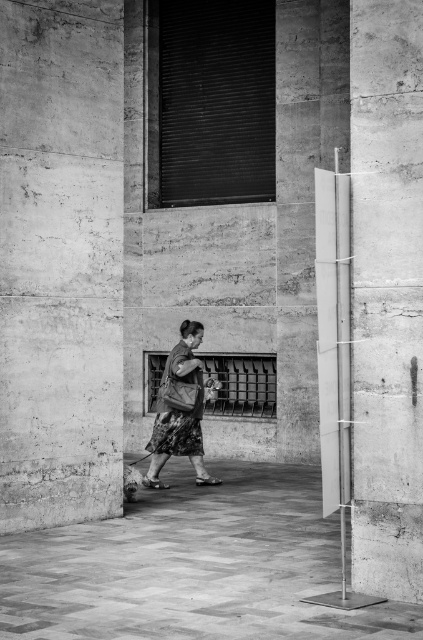
Is the position of polished stone pavement at lower center more distant than that of concrete pillar at right?

Yes.

Is polished stone pavement at lower center taller than concrete pillar at right?

In fact, polished stone pavement at lower center may be shorter than concrete pillar at right.

Locate an element on the screen. polished stone pavement at lower center is located at coordinates (192, 566).

Does concrete pillar at right appear under floral skirt at center?

Actually, concrete pillar at right is above floral skirt at center.

Who is lower down, concrete pillar at right or floral skirt at center?

floral skirt at center

The height and width of the screenshot is (640, 423). Find the location of `concrete pillar at right`. concrete pillar at right is located at coordinates (387, 296).

You are a GUI agent. You are given a task and a screenshot of the screen. Output one action in this format:
    pyautogui.click(x=<x>, y=<y>)
    Task: Click on the concrete pillar at right
    The width and height of the screenshot is (423, 640).
    Given the screenshot: What is the action you would take?
    pyautogui.click(x=387, y=296)

Does smooth concrete pillar at left have a greater width compared to polished stone pavement at lower center?

Incorrect, smooth concrete pillar at left's width does not surpass polished stone pavement at lower center's.

Does point (121, 58) come in front of point (197, 532)?

No, it is not.

Image resolution: width=423 pixels, height=640 pixels. What do you see at coordinates (60, 260) in the screenshot?
I see `smooth concrete pillar at left` at bounding box center [60, 260].

The height and width of the screenshot is (640, 423). Identify the location of smooth concrete pillar at left. (60, 260).